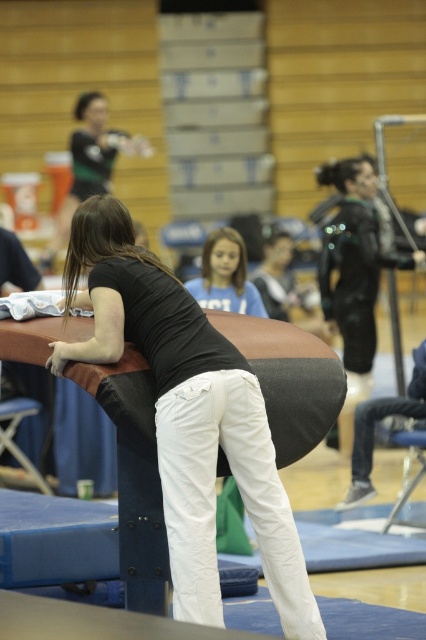
Question: Which object is the closest to the matte black shirt at center?

Choices:
 (A) matte blue shirt at center
 (B) matte black shirt at upper center
 (C) black leather jacket at upper right

Answer: (A)

Question: Is matte black shirt at upper center wider than matte blue shirt at center?

Choices:
 (A) yes
 (B) no

Answer: (A)

Question: From the image, what is the correct spatial relationship of matte black shirt at center in relation to black leather jacket at upper right?

Choices:
 (A) above
 (B) below

Answer: (B)

Question: Is matte black shirt at center to the right of black leather jacket at upper right from the viewer's perspective?

Choices:
 (A) yes
 (B) no

Answer: (B)

Question: Considering the real-world distances, which object is farthest from the matte blue shirt at center?

Choices:
 (A) matte black shirt at center
 (B) matte black shirt at upper center

Answer: (B)

Question: Which is farther from the matte black shirt at upper center?

Choices:
 (A) black leather jacket at upper right
 (B) matte blue shirt at center
 (C) matte black shirt at center

Answer: (C)